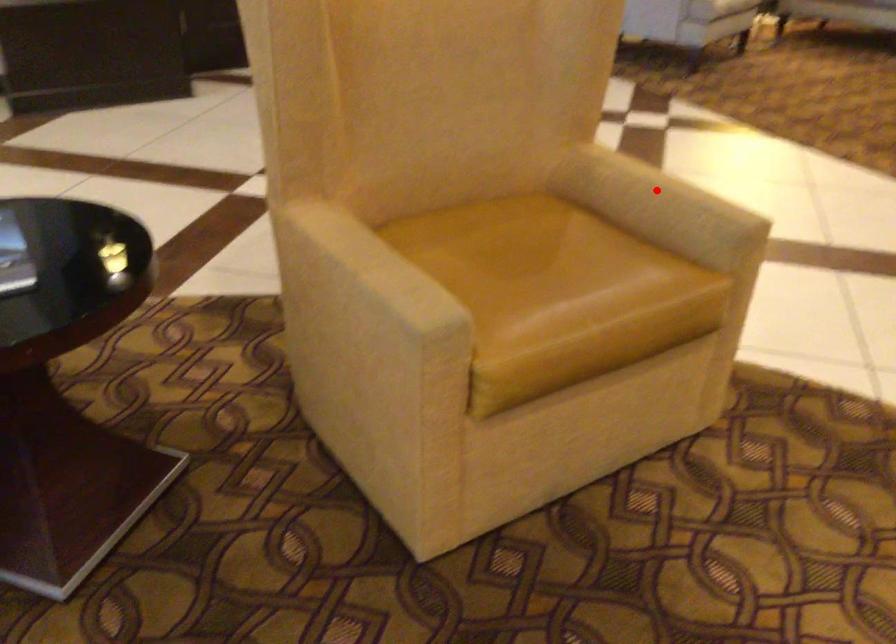
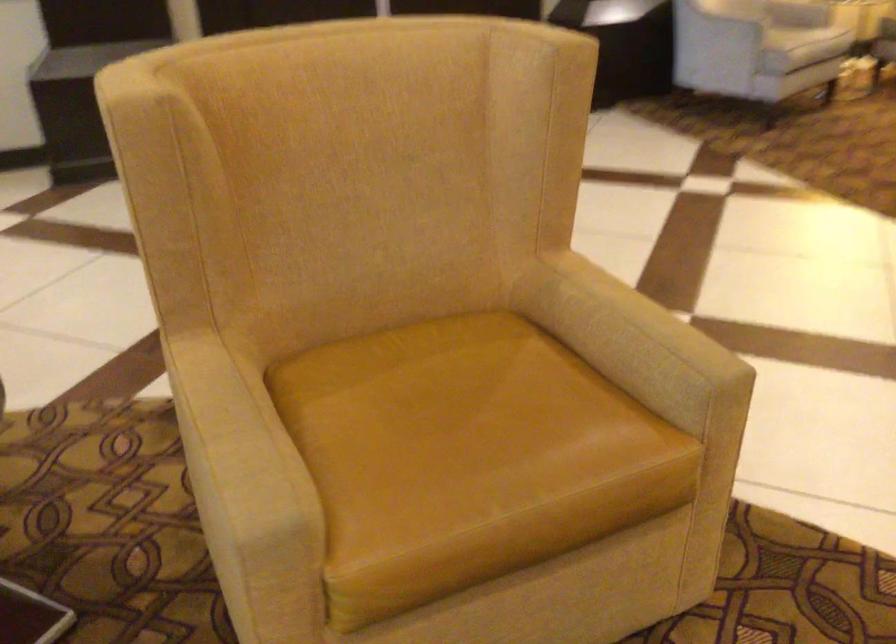
Question: I am providing you with two images of the same scene from different viewpoints. Given a red point in image1, look at the same physical point in image2. Is it:

Choices:
 (A) Closer to the viewpoint
 (B) Farther from the viewpoint

Answer: (A)